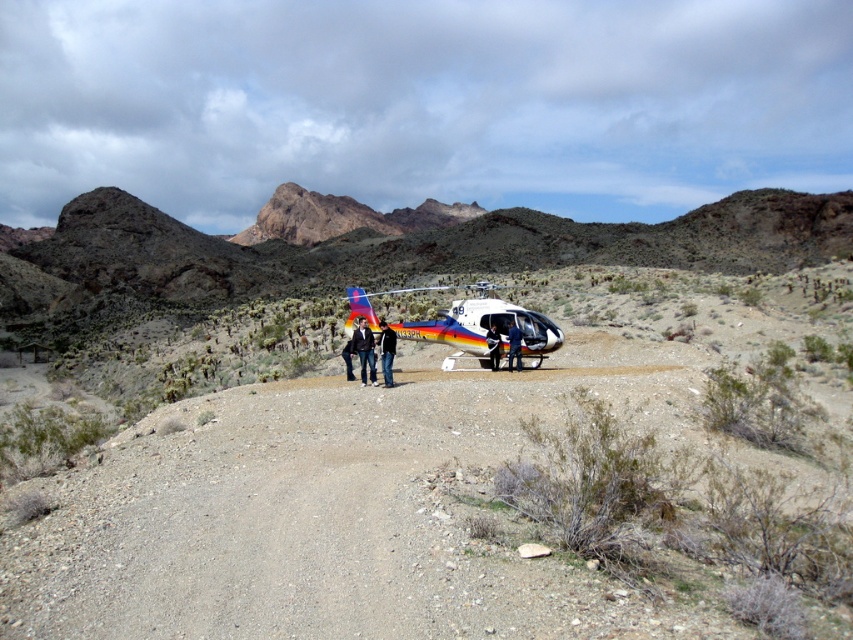
The image size is (853, 640). Describe the element at coordinates (308, 520) in the screenshot. I see `dusty gravel dirt track at center` at that location.

Does dusty gravel dirt track at center appear over denim jacket at center?

Incorrect, dusty gravel dirt track at center is not positioned above denim jacket at center.

Find the location of a particular element. dusty gravel dirt track at center is located at coordinates (308, 520).

Identify the location of dusty gravel dirt track at center. The width and height of the screenshot is (853, 640). (308, 520).

Who is positioned more to the left, dusty gravel dirt track at center or black leather jacket at center?

black leather jacket at center

Is point (265, 515) less distant than point (392, 369)?

That is True.

Describe the element at coordinates (308, 520) in the screenshot. I see `dusty gravel dirt track at center` at that location.

Where is `dusty gravel dirt track at center`? This screenshot has width=853, height=640. dusty gravel dirt track at center is located at coordinates (308, 520).

Is denim jacket at center positioned behind blue fabric jacket at center?

That is False.

Who is higher up, denim jacket at center or blue fabric jacket at center?

Positioned higher is denim jacket at center.

I want to click on denim jacket at center, so click(x=364, y=349).